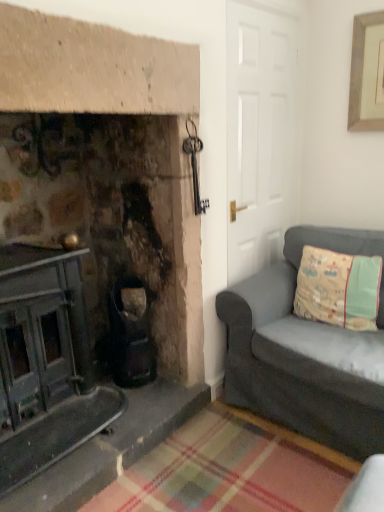
Question: Considering the positions of point (372, 271) and point (291, 404), is point (372, 271) closer or farther from the camera than point (291, 404)?

Choices:
 (A) closer
 (B) farther

Answer: (B)

Question: Is beige fabric pillow at right wider or thinner than dark gray fabric couch at right?

Choices:
 (A) wide
 (B) thin

Answer: (B)

Question: Based on their sizes in the image, would you say beige fabric pillow at right is bigger or smaller than dark gray fabric couch at right?

Choices:
 (A) small
 (B) big

Answer: (A)

Question: From the image's perspective, is dark gray fabric couch at right located above or below beige fabric pillow at right?

Choices:
 (A) below
 (B) above

Answer: (A)

Question: From a real-world perspective, is dark gray fabric couch at right above or below beige fabric pillow at right?

Choices:
 (A) above
 (B) below

Answer: (B)

Question: Considering their positions, is dark gray fabric couch at right located in front of or behind beige fabric pillow at right?

Choices:
 (A) front
 (B) behind

Answer: (A)

Question: Does point (241, 286) appear closer or farther from the camera than point (297, 307)?

Choices:
 (A) closer
 (B) farther

Answer: (A)